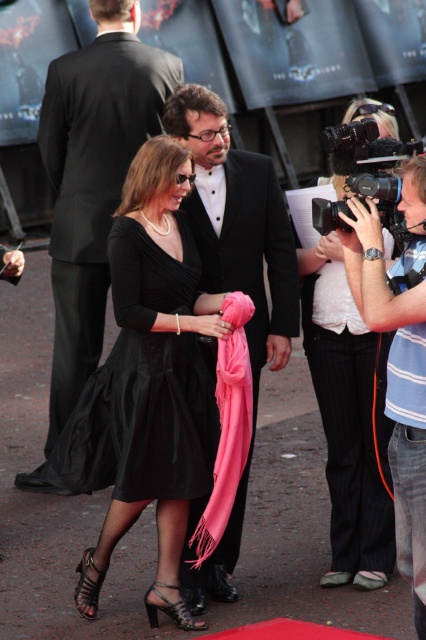
Measure the distance between satin black dress at center and camera.

The distance of satin black dress at center from camera is 4.60 meters.

Can you confirm if satin black dress at center is positioned to the right of black leather sandal at lower left?

Indeed, satin black dress at center is positioned on the right side of black leather sandal at lower left.

Where is `satin black dress at center`? This screenshot has height=640, width=426. satin black dress at center is located at coordinates (143, 385).

I want to click on satin black dress at center, so click(x=143, y=385).

Is the position of shiny black suit at center more distant than that of matte black dress at center?

That is True.

What are the coordinates of `shiny black suit at center` in the screenshot? It's located at (92, 179).

Where is `shiny black suit at center`? This screenshot has height=640, width=426. shiny black suit at center is located at coordinates (92, 179).

Who is more distant from viewer, (65, 333) or (172, 602)?

Point (65, 333)

Is point (63, 144) farther from camera compared to point (190, 621)?

Yes, it is.

Where is `shiny black suit at center`? This screenshot has height=640, width=426. shiny black suit at center is located at coordinates (92, 179).

Find the location of a particular element. shiny black suit at center is located at coordinates (92, 179).